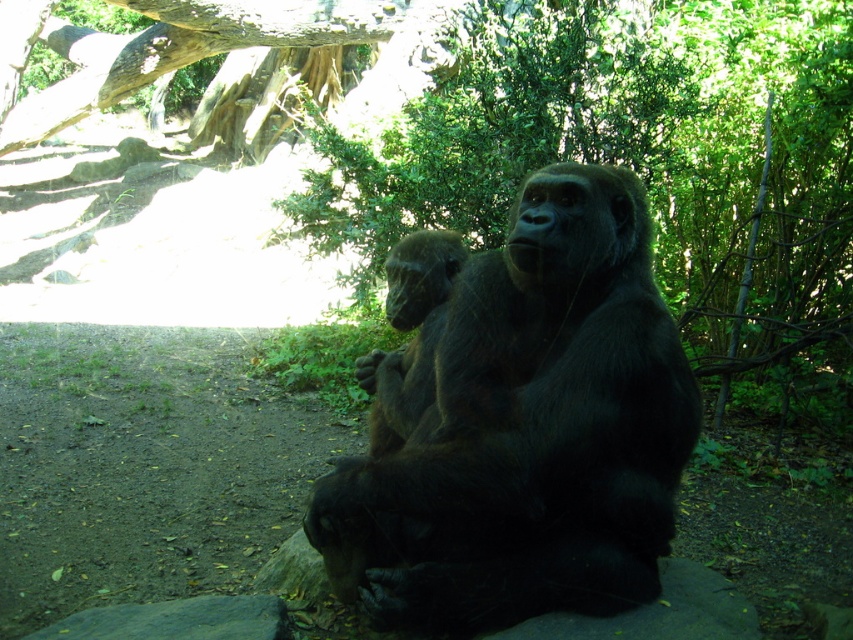
Which is above, green leafy tree at upper center or rough bark tree trunk at upper left?

Positioned higher is rough bark tree trunk at upper left.

Is green leafy tree at upper center further to the viewer compared to rough bark tree trunk at upper left?

No, green leafy tree at upper center is closer to the viewer.

Who is more forward, (788, 83) or (346, 12)?

Point (788, 83) is more forward.

You are a GUI agent. You are given a task and a screenshot of the screen. Output one action in this format:
    pyautogui.click(x=<x>, y=<y>)
    Task: Click on the green leafy tree at upper center
    This screenshot has height=640, width=853.
    Given the screenshot: What is the action you would take?
    pyautogui.click(x=645, y=168)

Which of these two, green leafy tree at upper center or dark brown fur gorilla at center, stands taller?

Standing taller between the two is green leafy tree at upper center.

From the picture: Which is more to the right, green leafy tree at upper center or dark brown fur gorilla at center?

green leafy tree at upper center is more to the right.

Describe the element at coordinates (645, 168) in the screenshot. I see `green leafy tree at upper center` at that location.

At what (x,y) coordinates should I click in order to perform the action: click on green leafy tree at upper center. Please return your answer as a coordinate pair (x, y). This screenshot has width=853, height=640. Looking at the image, I should click on (645, 168).

Does dark brown fur gorilla at center have a greater width compared to rough bark tree trunk at upper left?

Incorrect, dark brown fur gorilla at center's width does not surpass rough bark tree trunk at upper left's.

From the picture: Measure the distance between dark brown fur gorilla at center and rough bark tree trunk at upper left.

dark brown fur gorilla at center and rough bark tree trunk at upper left are 7.27 meters apart from each other.

Measure the distance between dark brown fur gorilla at center and camera.

A distance of 7.27 feet exists between dark brown fur gorilla at center and camera.

I want to click on dark brown fur gorilla at center, so click(x=543, y=435).